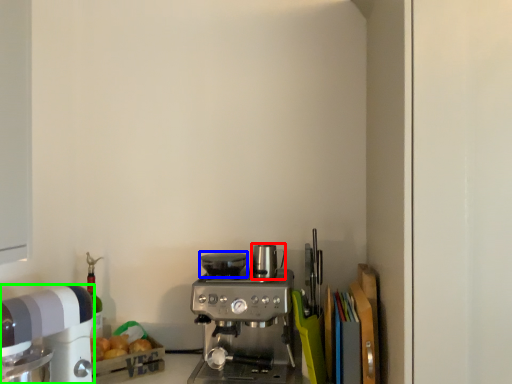
Question: Considering the real-world distances, which object is farthest from appliance (highlighted by a red box)? appliance (highlighted by a blue box) or kitchen appliance (highlighted by a green box)?

Choices:
 (A) appliance
 (B) kitchen appliance

Answer: (B)